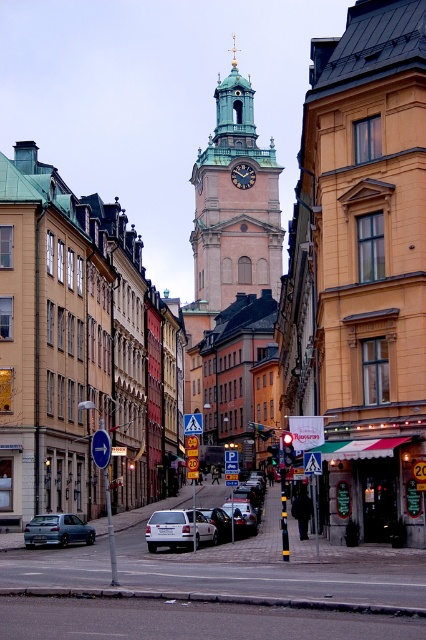
You are a tourist holding a map and looking at the blue plastic sign at left and the blue plastic arrow at center. Which object is bigger?

The blue plastic sign at left is larger than the blue plastic arrow at center.

You are a delivery driver in a city and need to park your silver metallic car at center in a parking spot that can only accommodate vehicles narrower than the dark brown wooden clock at center. Can your car fit in the parking spot?

The silver metallic car at center is thinner than the dark brown wooden clock at center, so it can fit in the parking spot designed for vehicles narrower than the clock.